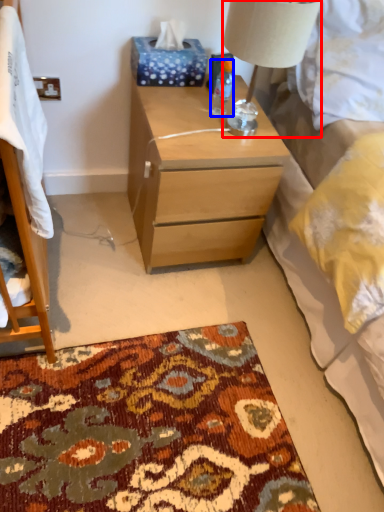
Question: Which object is further to the camera taking this photo, lamp (highlighted by a red box) or bottle (highlighted by a blue box)?

Choices:
 (A) lamp
 (B) bottle

Answer: (B)